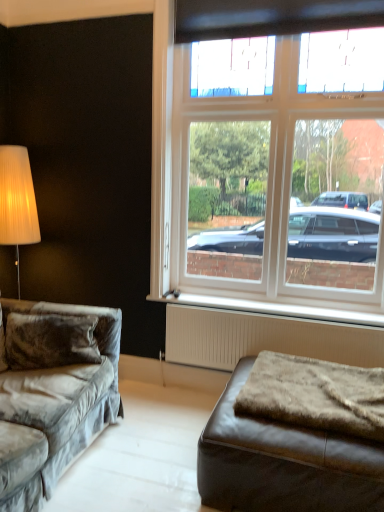
Locate an element on the screen. The width and height of the screenshot is (384, 512). empty space that is ontop of white textured radiator at lower center is located at coordinates (286, 312).